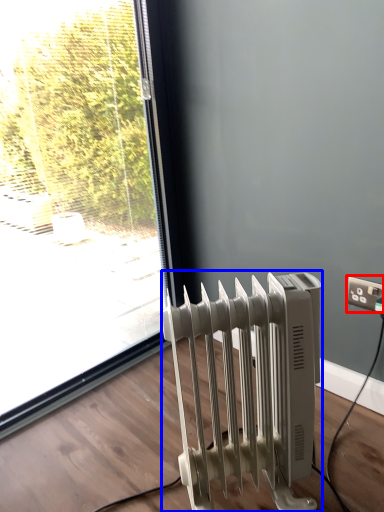
Question: Which of the following is the farthest to the observer, electric outlet (highlighted by a red box) or radiator (highlighted by a blue box)?

Choices:
 (A) electric outlet
 (B) radiator

Answer: (A)